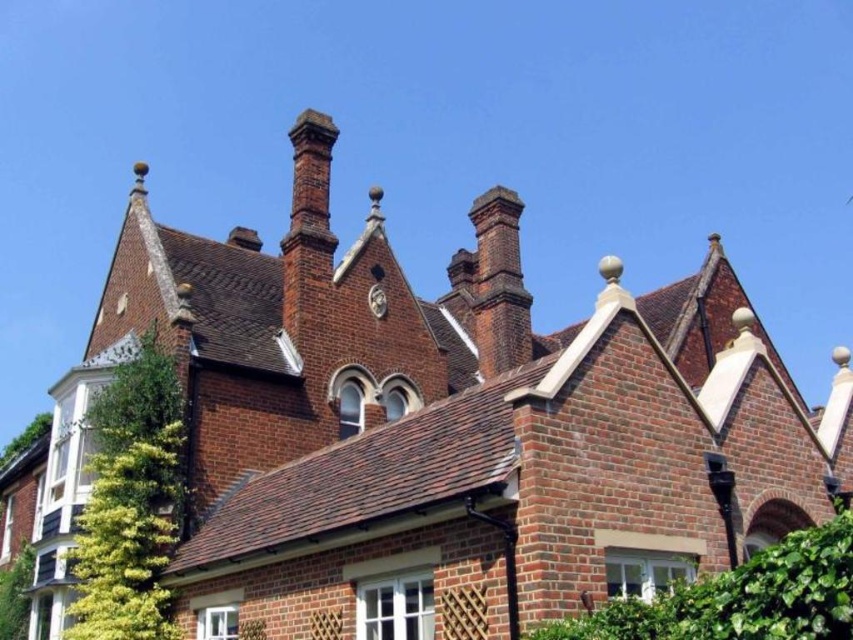
Can you confirm if green leafy hedge at lower right is smaller than red brick chimney at upper center?

Correct, green leafy hedge at lower right occupies less space than red brick chimney at upper center.

Between green leafy hedge at lower right and red brick chimney at upper center, which one is positioned higher?

red brick chimney at upper center is above.

At what (x,y) coordinates should I click in order to perform the action: click on green leafy hedge at lower right. Please return your answer as a coordinate pair (x, y). This screenshot has height=640, width=853. Looking at the image, I should click on (741, 596).

Which of these two, green leafy ivy at left or green leafy hedge at lower right, stands taller?

With more height is green leafy ivy at left.

At what (x,y) coordinates should I click in order to perform the action: click on green leafy ivy at left. Please return your answer as a coordinate pair (x, y). Looking at the image, I should click on coord(131,500).

Identify the location of green leafy ivy at left. (131, 500).

Between green leafy ivy at left and red brick chimney at upper center, which one has more height?

Standing taller between the two is red brick chimney at upper center.

Which is in front, point (161, 490) or point (508, 195)?

Point (161, 490) is more forward.

This screenshot has height=640, width=853. I want to click on green leafy ivy at left, so click(131, 500).